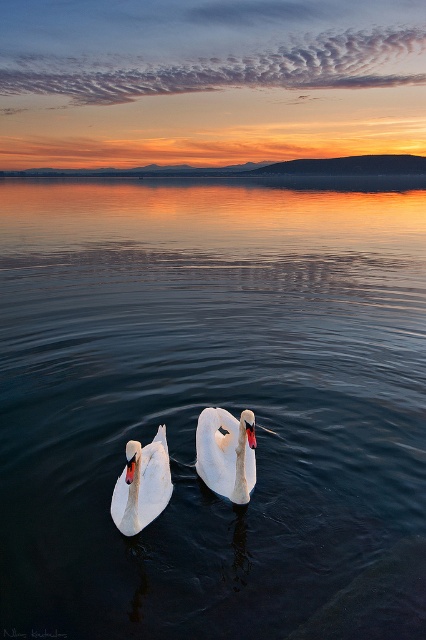
You are standing at the point with coordinates [123,499] and want to see the point at [278,372]. Can you see it without any obstruction?

Point [278,372] is behind point [123,499], so you cannot see it directly from your current position.

You are standing on a dock and see the smooth dark water at center. If you want to throw a stone into the water, will it land within 4 meters from where you are standing?

The smooth dark water at center is 4.11 meters away from viewer, so the stone will land 4.11 meters away, which is just beyond the 4 meter mark. Therefore, it will not land within 4 meters from where you are standing.